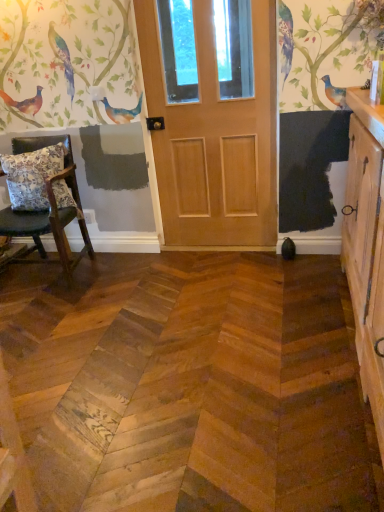
This screenshot has width=384, height=512. What do you see at coordinates (366, 246) in the screenshot?
I see `wooden cabinet at right` at bounding box center [366, 246].

Locate an element on the screen. This screenshot has height=512, width=384. wooden chair with cushion at left is located at coordinates (48, 211).

Image resolution: width=384 pixels, height=512 pixels. Identify the location of floral fabric cushion at left. (32, 176).

From a real-world perspective, is wooden cabinet at right positioned above or below natural wood door at center?

Clearly, from a real-world perspective, wooden cabinet at right is below natural wood door at center.

From the image's perspective, is wooden cabinet at right positioned above or below natural wood door at center?

wooden cabinet at right is below natural wood door at center.

Does point (376, 234) come in front of point (243, 96)?

Yes, it is.

Consider the image. Can natural wood door at center be found inside wooden cabinet at right?

Definitely not — natural wood door at center is not inside wooden cabinet at right.

The height and width of the screenshot is (512, 384). I want to click on cabinetry above the wooden chair with cushion at left (from a real-world perspective), so click(x=366, y=246).

From the picture: From the image's perspective, which one is positioned lower, wooden chair with cushion at left or wooden cabinet at right?

wooden cabinet at right, from the image's perspective.

Is wooden chair with cushion at left taller than wooden cabinet at right?

No, wooden chair with cushion at left is not taller than wooden cabinet at right.

Is wooden chair with cushion at left placed right next to wooden cabinet at right?

wooden chair with cushion at left and wooden cabinet at right are not in contact.

How many degrees apart are the facing directions of floral fabric cushion at left and wooden cabinet at right?

The angular difference between floral fabric cushion at left and wooden cabinet at right is 89.4 degrees.

From a real-world perspective, who is located higher, floral fabric cushion at left or wooden cabinet at right?

floral fabric cushion at left.

From the image's perspective, would you say floral fabric cushion at left is shown under wooden cabinet at right?

Actually, floral fabric cushion at left appears above wooden cabinet at right in the image.

Considering the sizes of objects floral fabric cushion at left and wooden cabinet at right in the image provided, who is bigger, floral fabric cushion at left or wooden cabinet at right?

wooden cabinet at right is bigger.

Find the location of a particular element. cabinetry directly beneath the natural wood door at center (from a real-world perspective) is located at coordinates (366, 246).

How different are the orientations of natural wood door at center and wooden cabinet at right in degrees?

natural wood door at center and wooden cabinet at right are facing 91.2 degrees away from each other.

Is natural wood door at center beside wooden cabinet at right?

No.

Is wooden chair with cushion at left at the left side of natural wood door at center?

Yes, wooden chair with cushion at left is to the left of natural wood door at center.

Is wooden chair with cushion at left turned away from natural wood door at center?

No, wooden chair with cushion at left is not facing away from natural wood door at center.

Is wooden chair with cushion at left next to natural wood door at center and touching it?

No, wooden chair with cushion at left is not touching natural wood door at center.

Which of these two, wooden chair with cushion at left or natural wood door at center, is wider?

wooden chair with cushion at left.

Would you say wooden cabinet at right is a long distance from floral fabric cushion at left?

That's right, there is a large distance between wooden cabinet at right and floral fabric cushion at left.

Between wooden cabinet at right and floral fabric cushion at left, which one has larger size?

wooden cabinet at right is bigger.

Which of these two, wooden cabinet at right or floral fabric cushion at left, is wider?

With larger width is wooden cabinet at right.

How different are the orientations of wooden cabinet at right and floral fabric cushion at left in degrees?

The angle between the facing direction of wooden cabinet at right and the facing direction of floral fabric cushion at left is 89.4 degrees.

Could you tell me if wooden chair with cushion at left is facing floral fabric cushion at left?

Yes, wooden chair with cushion at left is facing floral fabric cushion at left.

Is wooden chair with cushion at left thinner than floral fabric cushion at left?

No, wooden chair with cushion at left is not thinner than floral fabric cushion at left.

Considering the relative sizes of wooden chair with cushion at left and floral fabric cushion at left in the image provided, is wooden chair with cushion at left shorter than floral fabric cushion at left?

No.

This screenshot has height=512, width=384. I want to click on pillow above the wooden chair with cushion at left (from the image's perspective), so click(32, 176).

Where is `cabinetry in front of the natural wood door at center`? This screenshot has width=384, height=512. cabinetry in front of the natural wood door at center is located at coordinates (366, 246).

Locate an element on the screen. The image size is (384, 512). cabinetry located below the wooden chair with cushion at left (from the image's perspective) is located at coordinates (366, 246).

Considering their positions, is natural wood door at center positioned closer to wooden cabinet at right than wooden chair with cushion at left?

Among the two, natural wood door at center is located nearer to wooden cabinet at right.

Which object lies further to the anchor point wooden cabinet at right, wooden chair with cushion at left or floral fabric cushion at left?

floral fabric cushion at left is further to wooden cabinet at right.

Which object lies nearer to the anchor point wooden cabinet at right, wooden chair with cushion at left or natural wood door at center?

natural wood door at center is closer to wooden cabinet at right.

Looking at the image, which one is located closer to wooden chair with cushion at left, floral fabric cushion at left or wooden cabinet at right?

floral fabric cushion at left is positioned closer to the anchor wooden chair with cushion at left.

Estimate the real-world distances between objects in this image. Which object is further from natural wood door at center, floral fabric cushion at left or wooden cabinet at right?

Based on the image, wooden cabinet at right appears to be further to natural wood door at center.

Looking at the image, which one is located further to natural wood door at center, floral fabric cushion at left or wooden chair with cushion at left?

Based on the image, floral fabric cushion at left appears to be further to natural wood door at center.

Estimate the real-world distances between objects in this image. Which object is closer to wooden chair with cushion at left, wooden cabinet at right or floral fabric cushion at left?

Among the two, floral fabric cushion at left is located nearer to wooden chair with cushion at left.

Considering their positions, is floral fabric cushion at left positioned closer to wooden cabinet at right than wooden chair with cushion at left?

wooden chair with cushion at left lies closer to wooden cabinet at right than the other object.

I want to click on door between wooden cabinet at right and floral fabric cushion at left along the z-axis, so click(212, 118).

Identify the location of chair situated between floral fabric cushion at left and wooden cabinet at right from left to right. This screenshot has height=512, width=384. (48, 211).

Where is `chair between wooden cabinet at right and natural wood door at center along the z-axis`? This screenshot has width=384, height=512. chair between wooden cabinet at right and natural wood door at center along the z-axis is located at coordinates (48, 211).

Where is `chair between floral fabric cushion at left and natural wood door at center from left to right`? chair between floral fabric cushion at left and natural wood door at center from left to right is located at coordinates (48, 211).